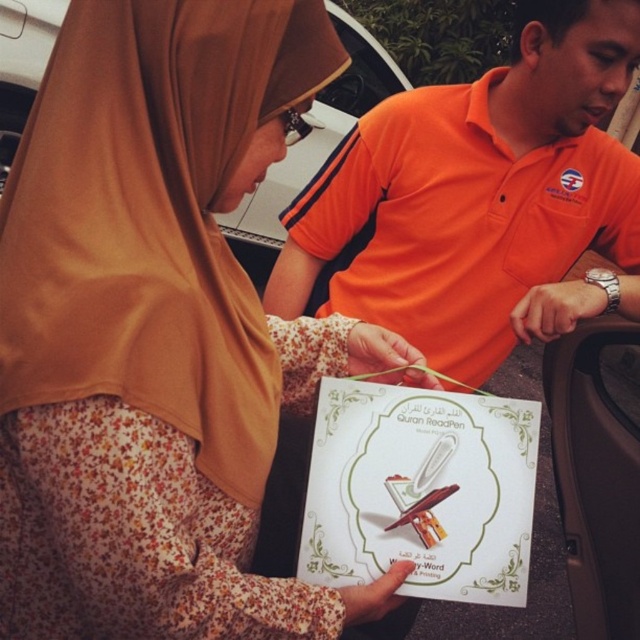
You are a delivery driver who just arrived at a location and see an orange cotton shirt at center and a white plastic car at center. Which object is closer to the ground?

The orange cotton shirt at center is located below the white plastic car at center, so it is closer to the ground.

You are a delivery person who needs to hand over a package to the person holding the Quran ReadPen box. The package you have is exactly 60 centimeters in length. Can you safely place the package on the white paper at center without exceeding its edges?

The white paper at center and viewer are 60.41 centimeters apart from each other. Since the package is 60 centimeters long, it can be placed on the white paper at center as the distance between them allows for the package to fit without exceeding the edges.